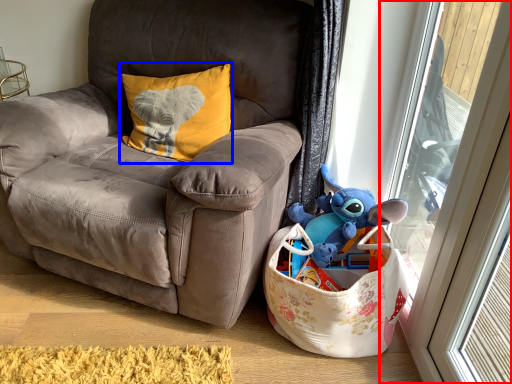
Question: Which object appears closest to the camera in this image, glass door (highlighted by a red box) or pillow (highlighted by a blue box)?

Choices:
 (A) glass door
 (B) pillow

Answer: (A)